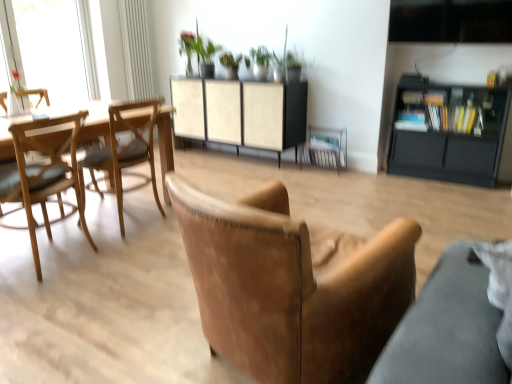
Question: From a real-world perspective, does light brown wooden chair at left, which appears as the third chair when viewed from the right, stand above green matte plant at upper center?

Choices:
 (A) no
 (B) yes

Answer: (A)

Question: Is light brown wooden chair at left, which appears as the third chair when viewed from the right, shorter than green matte plant at upper center?

Choices:
 (A) yes
 (B) no

Answer: (B)

Question: From the image's perspective, does light brown wooden chair at left, which appears as the third chair when viewed from the right, appear higher than green matte plant at upper center?

Choices:
 (A) no
 (B) yes

Answer: (A)

Question: Is light brown wooden chair at left, placed as the first chair when sorted from left to right, completely or partially outside of green matte plant at upper center?

Choices:
 (A) no
 (B) yes

Answer: (B)

Question: From the image's perspective, would you say light brown wooden chair at left, which appears as the third chair when viewed from the right, is shown under green matte plant at upper center?

Choices:
 (A) yes
 (B) no

Answer: (A)

Question: In the image, is woodenmaterial/texturetable at left positioned in front of or behind light brown wood chair at left, which is the second chair from left to right?

Choices:
 (A) behind
 (B) front

Answer: (B)

Question: Is woodenmaterial/texturetable at left bigger or smaller than light brown wood chair at left, which is the second chair from left to right?

Choices:
 (A) big
 (B) small

Answer: (A)

Question: Considering the positions of woodenmaterial/texturetable at left and light brown wood chair at left, which is the second chair from left to right, in the image, is woodenmaterial/texturetable at left taller or shorter than light brown wood chair at left, which is the second chair from left to right,?

Choices:
 (A) short
 (B) tall

Answer: (A)

Question: Is point (147, 112) closer or farther from the camera than point (104, 158)?

Choices:
 (A) closer
 (B) farther

Answer: (B)

Question: Is brown leather armchair at center in front of or behind black matte cabinet at right, which is the 1th cabinetry in right-to-left order, in the image?

Choices:
 (A) front
 (B) behind

Answer: (B)

Question: Considering the positions of brown leather armchair at center and black matte cabinet at right, which is the 1th cabinetry in right-to-left order, in the image, is brown leather armchair at center wider or thinner than black matte cabinet at right, which is the 1th cabinetry in right-to-left order,?

Choices:
 (A) thin
 (B) wide

Answer: (A)

Question: Does point coord(302,157) appear closer or farther from the camera than point coord(457,87)?

Choices:
 (A) closer
 (B) farther

Answer: (B)

Question: From a real-world perspective, relative to black matte cabinet at right, acting as the 2th cabinetry starting from the left, is brown leather armchair at center vertically above or below?

Choices:
 (A) below
 (B) above

Answer: (A)

Question: In the image, is green matte plant at upper center on the left side or the right side of beige woven cabinet at center, marked as the 1th cabinetry in a left-to-right arrangement?

Choices:
 (A) left
 (B) right

Answer: (B)

Question: Considering their positions, is green matte plant at upper center located in front of or behind beige woven cabinet at center, the 2th cabinetry in the right-to-left sequence?

Choices:
 (A) front
 (B) behind

Answer: (B)